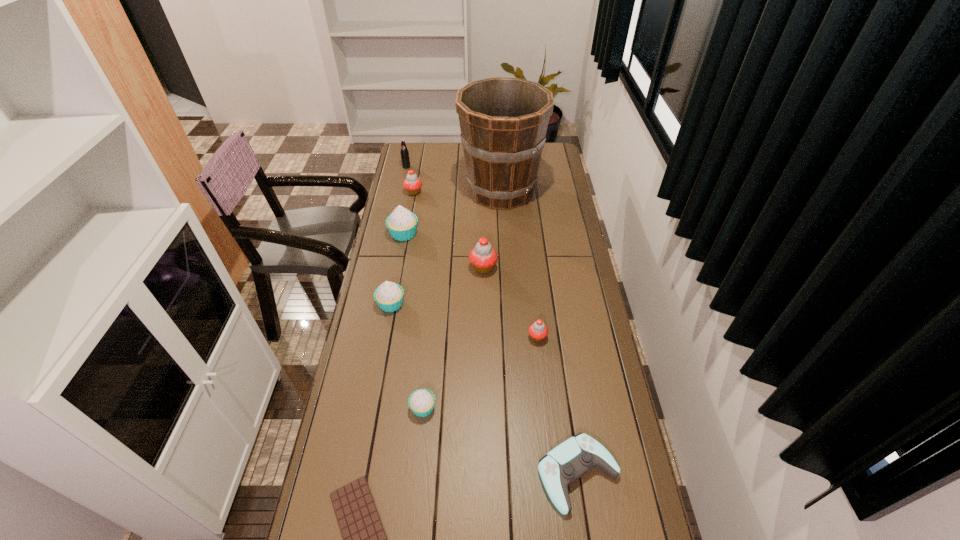
Locate an element on the screen. Image resolution: width=960 pixels, height=540 pixels. vacant area in the image that satisfies the following two spatial constraints: 1. on the front side of the biggest red cupcake; 2. on the left side of the biggest white cupcake is located at coordinates (397, 267).

The width and height of the screenshot is (960, 540). Identify the location of vacant space that satisfies the following two spatial constraints: 1. on the front side of the second shortest object; 2. on the right side of the fourth nearest cupcake. (485, 474).